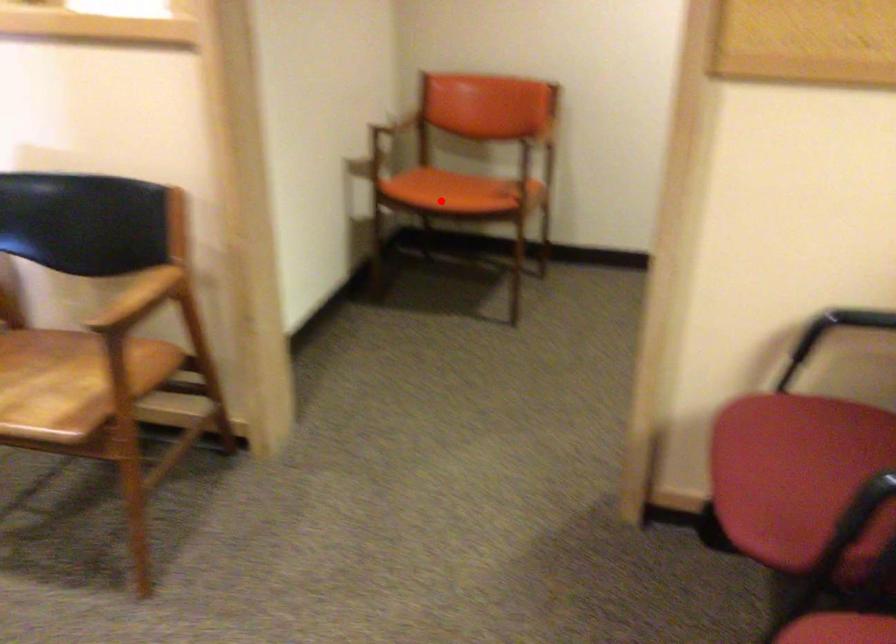
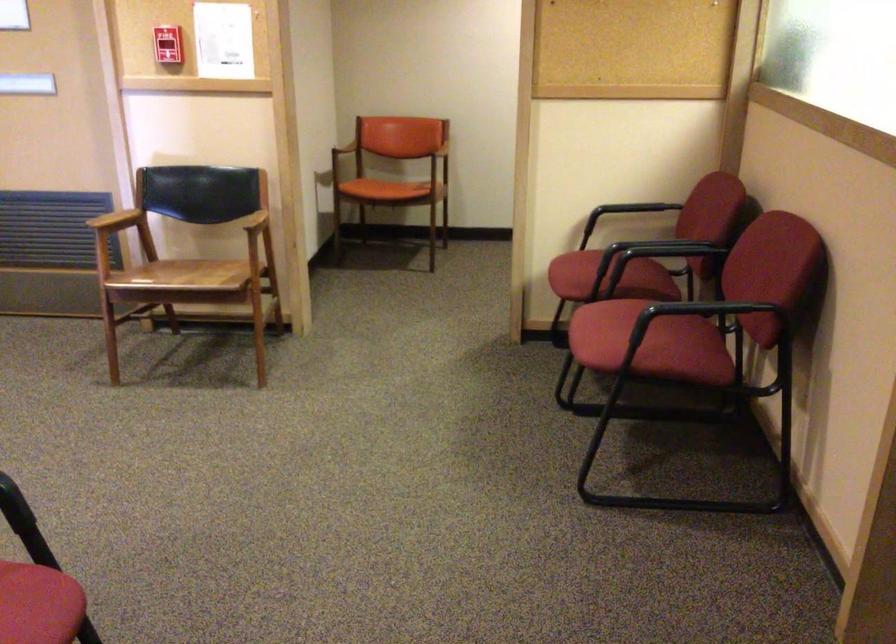
Question: I am providing you with two images of the same scene from different viewpoints. A red point is shown in image1. For the corresponding object point in image2, is it positioned nearer or farther from the camera?

Choices:
 (A) Nearer
 (B) Farther

Answer: (B)